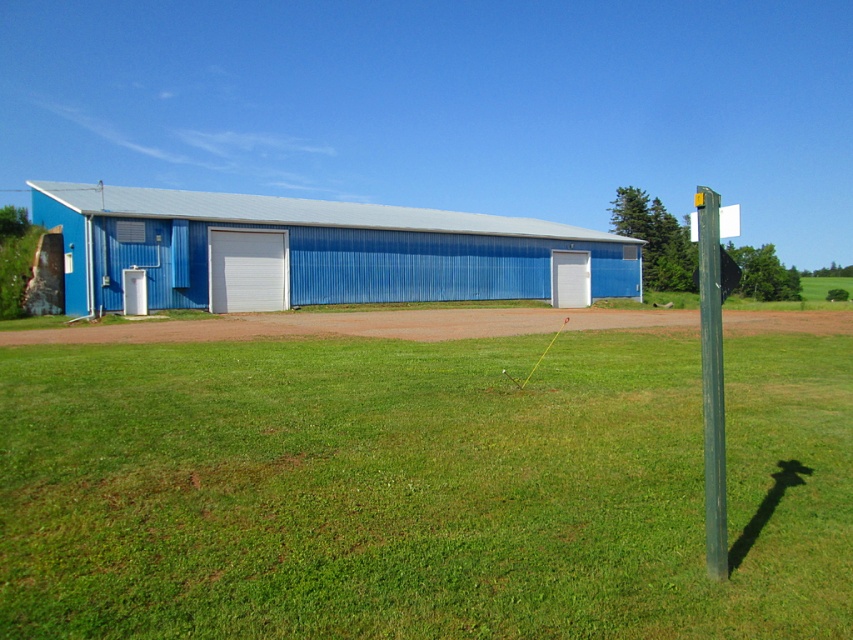
Question: Which object appears farthest from the camera in this image?

Choices:
 (A) green metallic pole at right
 (B) white smooth garage door at center
 (C) blue corrugated metal hangar at center
 (D) white matte garage door at center

Answer: (D)

Question: Observing the image, what is the correct spatial positioning of white smooth garage door at center in reference to white matte garage door at center?

Choices:
 (A) right
 (B) left

Answer: (B)

Question: Is green metallic pole at right to the left of white smooth garage door at center from the viewer's perspective?

Choices:
 (A) no
 (B) yes

Answer: (A)

Question: Which point appears closest to the camera in this image?

Choices:
 (A) (567, 257)
 (B) (485, 376)
 (C) (274, 278)
 (D) (701, 310)

Answer: (B)

Question: Which object is the farthest from the blue corrugated metal hangar at center?

Choices:
 (A) green metallic pole at right
 (B) white smooth garage door at center
 (C) green grass at center
 (D) white matte garage door at center

Answer: (C)

Question: Does blue corrugated metal hangar at center appear on the left side of white smooth garage door at center?

Choices:
 (A) no
 (B) yes

Answer: (B)